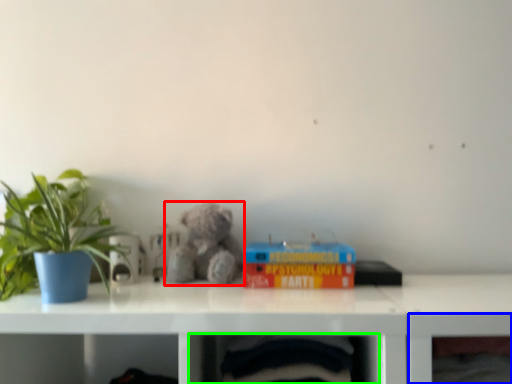
Question: Which is nearer to the teddy bear (highlighted by a red box)? shelf (highlighted by a blue box) or shelf (highlighted by a green box).

Choices:
 (A) shelf
 (B) shelf

Answer: (B)